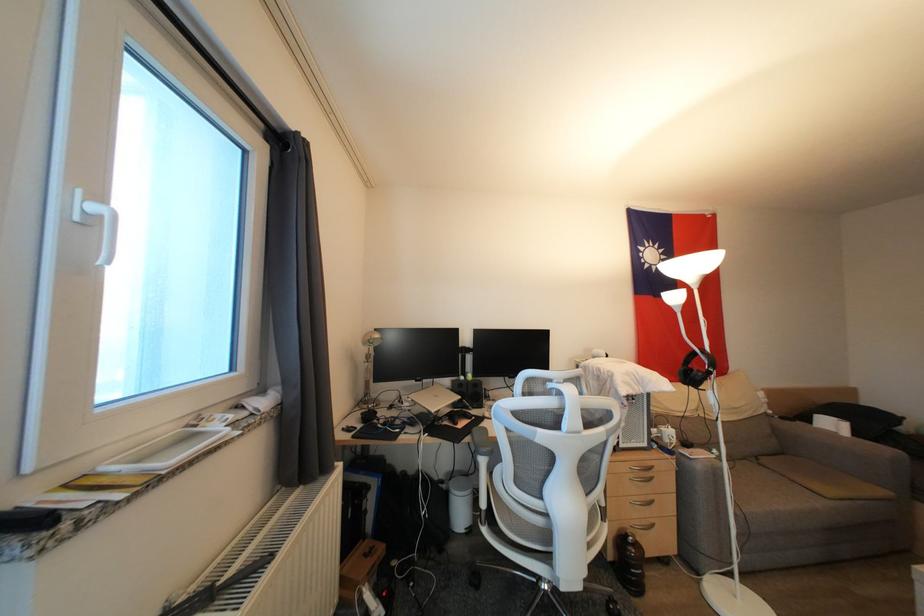
Where would you adjust the silver lamp head? Please return your answer as a coordinate pair (x, y).

(691, 265)